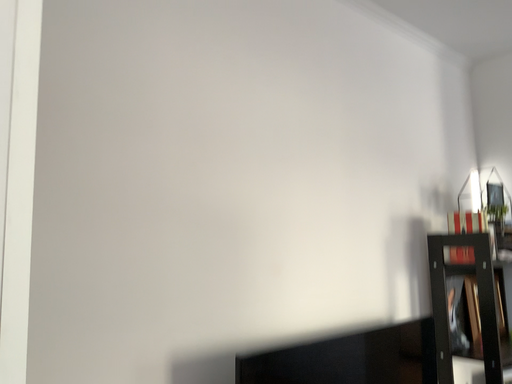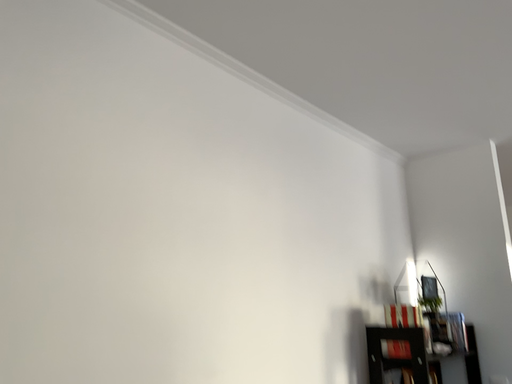
Question: How did the camera likely rotate when shooting the video?

Choices:
 (A) rotated downward
 (B) rotated upward

Answer: (B)